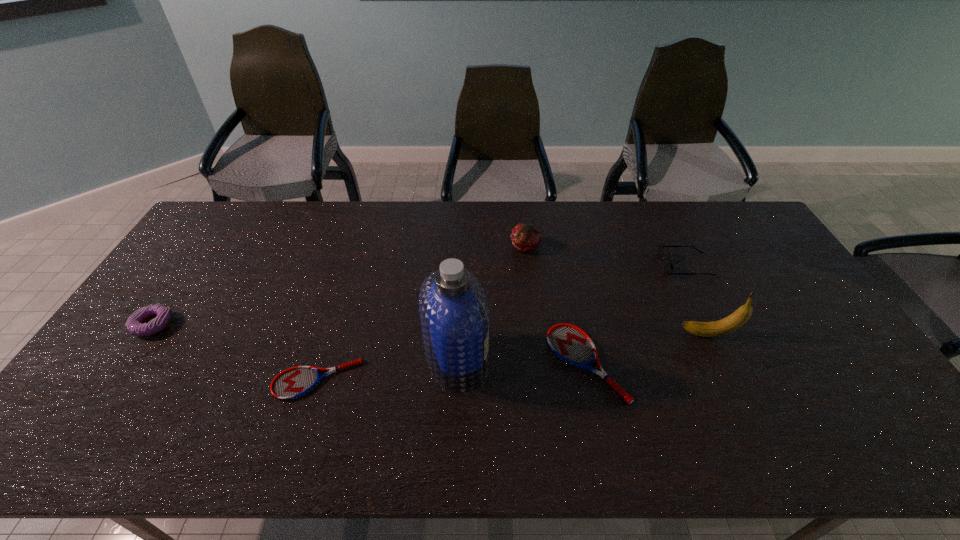
Locate an element on the screen. Image resolution: width=960 pixels, height=540 pixels. object that can be found as the fifth closest to the taller tennis racket is located at coordinates (292, 383).

Identify the location of free point that satisfies the following two spatial constraints: 1. at the start of the peel on the second tallest object; 2. on the front side of the cleansing agent. The width and height of the screenshot is (960, 540). (721, 360).